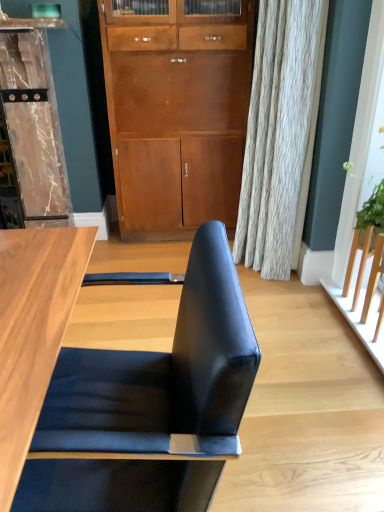
Question: From the image's perspective, is marble/textured dresser at left above or below matte wood cabinet at center?

Choices:
 (A) below
 (B) above

Answer: (A)

Question: In the image, is marble/textured dresser at left positioned in front of or behind matte wood cabinet at center?

Choices:
 (A) behind
 (B) front

Answer: (B)

Question: Estimate the real-world distances between objects in this image. Which object is closer to the black leather chair at center?

Choices:
 (A) matte wood cabinet at center
 (B) marble/textured dresser at left

Answer: (A)

Question: Estimate the real-world distances between objects in this image. Which object is closer to the marble/textured dresser at left?

Choices:
 (A) matte wood cabinet at center
 (B) black leather chair at center

Answer: (A)